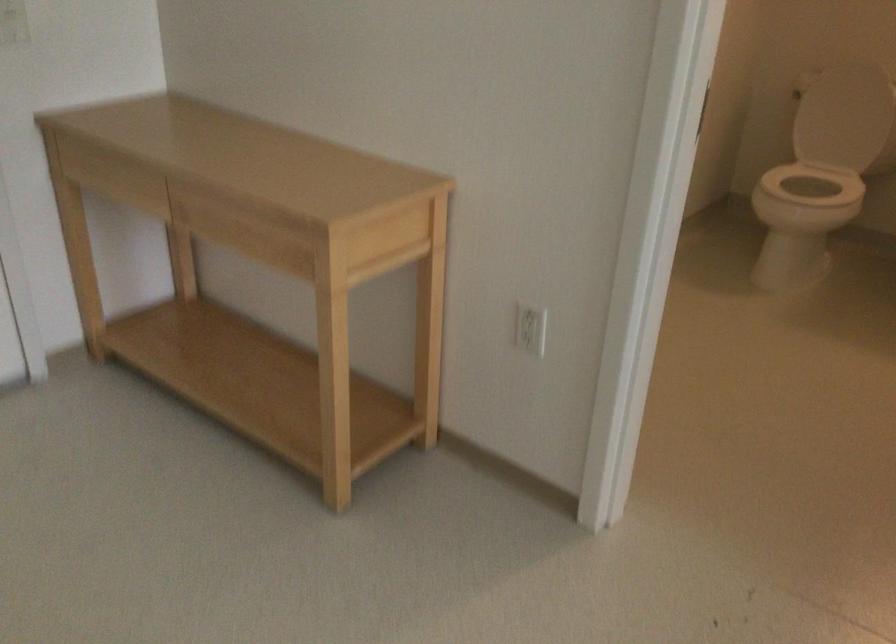
What do you see at coordinates (839, 118) in the screenshot?
I see `the white toilet lid` at bounding box center [839, 118].